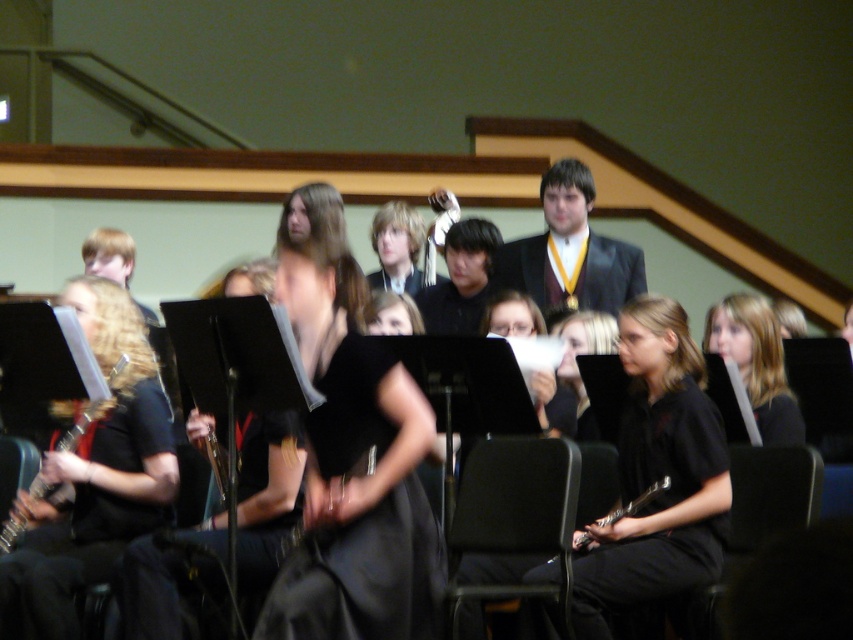
Question: Does black fabric chair at center appear on the left side of metallic silver flute at lower center?

Choices:
 (A) yes
 (B) no

Answer: (A)

Question: From the image, what is the correct spatial relationship of smooth black dress at center in relation to metallic silver flute at lower center?

Choices:
 (A) below
 (B) above

Answer: (B)

Question: Estimate the real-world distances between objects in this image. Which object is closer to the black fabric hair at right?

Choices:
 (A) black fabric chair at center
 (B) shiny gold medal at upper center
 (C) black matte shirt at center

Answer: (B)

Question: In this image, where is black matte shirt at center located relative to wooden saxophone at left?

Choices:
 (A) right
 (B) left

Answer: (A)

Question: Which of the following is the farthest from the observer?

Choices:
 (A) (383, 310)
 (B) (74, 428)
 (C) (616, 513)

Answer: (A)

Question: Considering the real-world distances, which object is closest to the black matte shirt at center?

Choices:
 (A) matte black dress at center
 (B) wooden saxophone at left
 (C) black fabric chair at center
 (D) smooth black dress at center

Answer: (A)